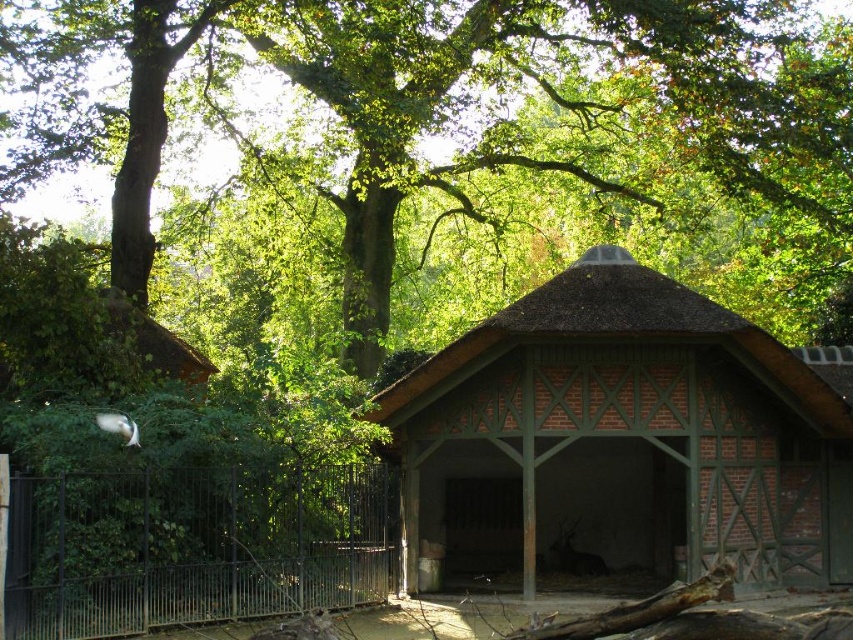
In the scene shown: You are an architect designing a new path that needs to pass between the green leafy tree at upper center and the brown brick hut at center. Based on their widths, which object requires more space on the path?

The green leafy tree at upper center requires more space on the path because its width is larger than the brown brick hut at center.